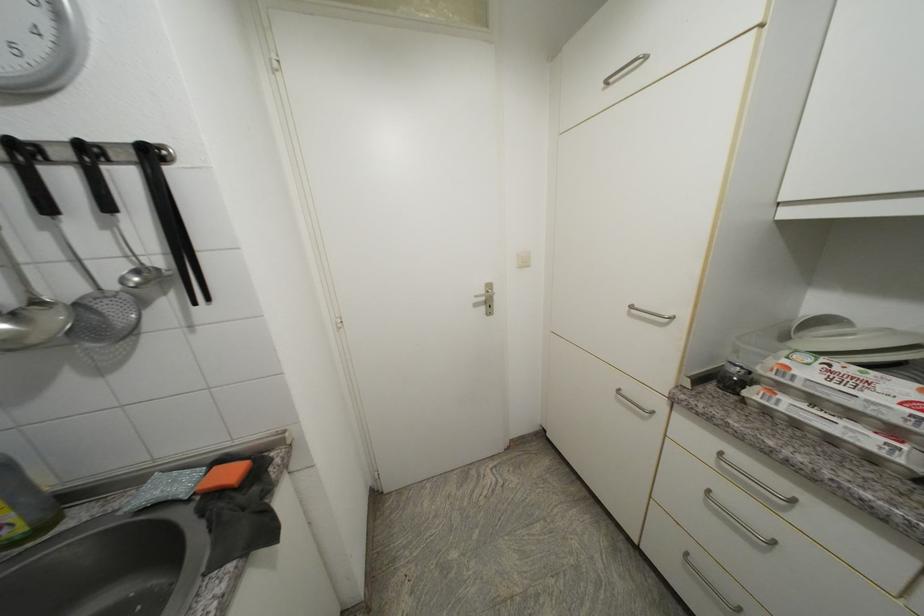
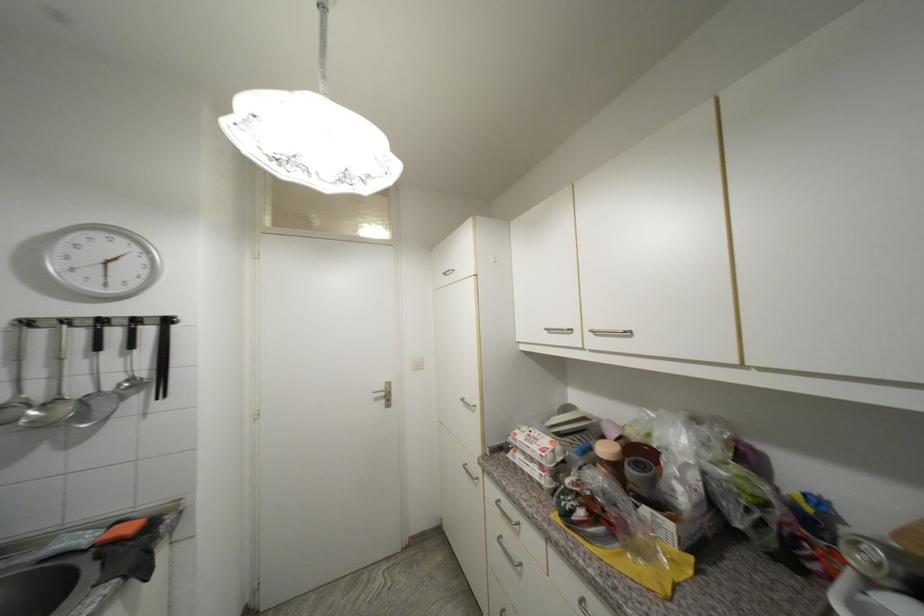
The point at (30, 152) is marked in the first image. Where is the corresponding point in the second image?

(108, 323)